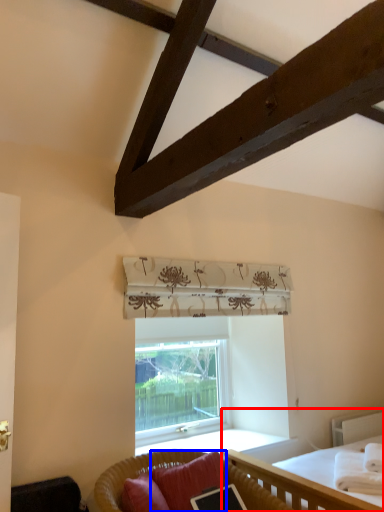
Question: Which object is further to the camera taking this photo, bed (highlighted by a red box) or pillow (highlighted by a blue box)?

Choices:
 (A) bed
 (B) pillow

Answer: (B)